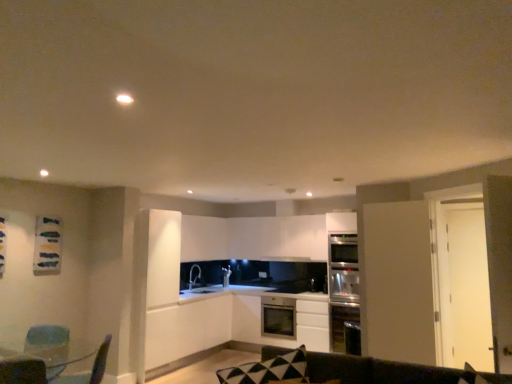
Question: Looking at the image, does stainless steel oven at center, the 3th cabinetry viewed from the top, seem bigger or smaller compared to green fabric swivel chair at lower left, the first swivel chair in the left-to-right sequence?

Choices:
 (A) small
 (B) big

Answer: (B)

Question: Would you say stainless steel oven at center, the 3th cabinetry viewed from the top, is to the left or to the right of green fabric swivel chair at lower left, the first swivel chair in the left-to-right sequence, in the picture?

Choices:
 (A) left
 (B) right

Answer: (B)

Question: Which of these objects is positioned farthest from the white matte cabinet at center, which is counted as the first cabinetry, starting from the top?

Choices:
 (A) matte glass table at lower left
 (B) stainless steel oven at center, the 3th cabinetry viewed from the top
 (C) white matte cabinet at center, which is the second cabinetry from bottom to top
 (D) metallic blue swivel chair at lower left, the second swivel chair when ordered from left to right
 (E) satin silver oven at right

Answer: (A)

Question: Which object is the closest to the white matte cabinet at center, which is the second cabinetry from bottom to top?

Choices:
 (A) metallic blue swivel chair at lower left, which is the first swivel chair in right-to-left order
 (B) dark brown leather couch at lower center
 (C) green fabric swivel chair at lower left, the first swivel chair in the left-to-right sequence
 (D) stainless steel oven at center, which is the first cabinetry in bottom-to-top order
 (E) satin silver oven at right

Answer: (D)